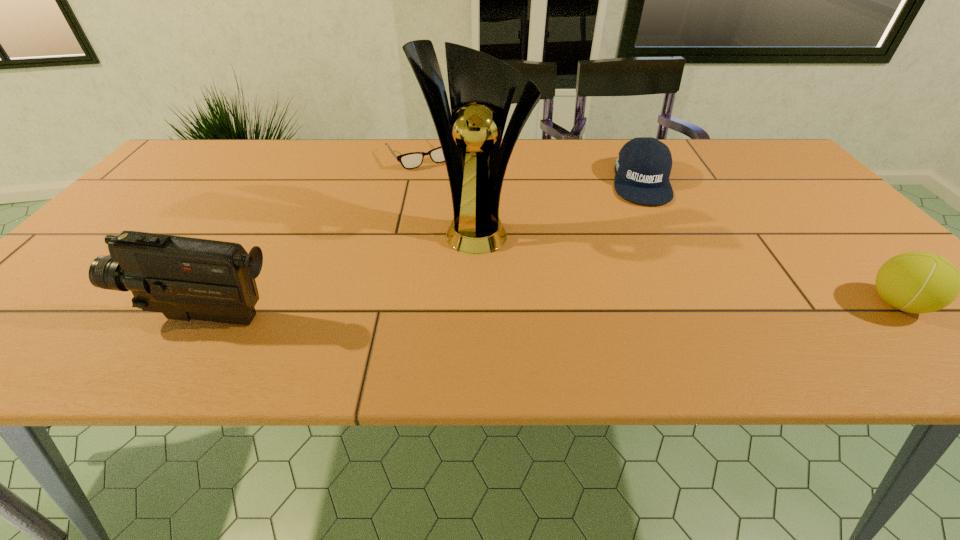
This screenshot has height=540, width=960. I want to click on baseball cap present at the far edge, so click(x=643, y=166).

Locate an element on the screen. spectacles present at the far edge is located at coordinates (412, 160).

In order to click on camcorder that is positioned at the near edge in this screenshot , I will do `click(184, 278)`.

The width and height of the screenshot is (960, 540). What are the coordinates of `tennis ball present at the near edge` in the screenshot? It's located at (915, 282).

Identify the location of object situated at the right edge. (915, 282).

Image resolution: width=960 pixels, height=540 pixels. Find the location of `object that is at the near right corner`. object that is at the near right corner is located at coordinates (915, 282).

Identify the location of blank space at the far edge of the desktop. (508, 173).

In the image, there is a desktop. Identify the location of vacant space at the near edge. The width and height of the screenshot is (960, 540). (491, 315).

Find the location of a particular element. This screenshot has width=960, height=540. vacant space at the right edge of the desktop is located at coordinates (752, 183).

In the image, there is a desktop. Where is `free space at the far left corner`? free space at the far left corner is located at coordinates (210, 151).